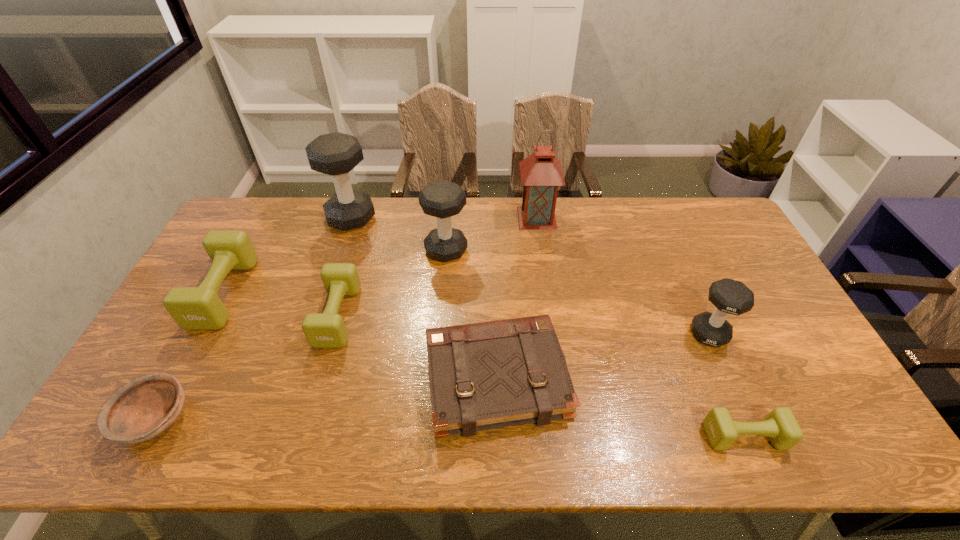
I want to click on lantern, so click(541, 173).

Where is `the farthest gray dumbbell`? The image size is (960, 540). the farthest gray dumbbell is located at coordinates (336, 154).

Where is `the farthest dumbbell`? This screenshot has height=540, width=960. the farthest dumbbell is located at coordinates (336, 154).

The height and width of the screenshot is (540, 960). I want to click on the seventh shortest object, so (x=442, y=199).

Image resolution: width=960 pixels, height=540 pixels. I want to click on the second tallest dumbbell, so click(x=442, y=199).

Identify the location of the fourth shortest dumbbell. This screenshot has height=540, width=960. (729, 296).

Identify the location of the smallest gray dumbbell. (729, 296).

Where is `the leftmost dumbbell`? The image size is (960, 540). the leftmost dumbbell is located at coordinates (193, 308).

At what (x,y) coordinates should I click in order to perform the action: click on the third shortest dumbbell. Please return your answer as a coordinate pair (x, y). The image size is (960, 540). Looking at the image, I should click on (193, 308).

Locate an element on the screen. This screenshot has height=540, width=960. the second shortest dumbbell is located at coordinates (322, 330).